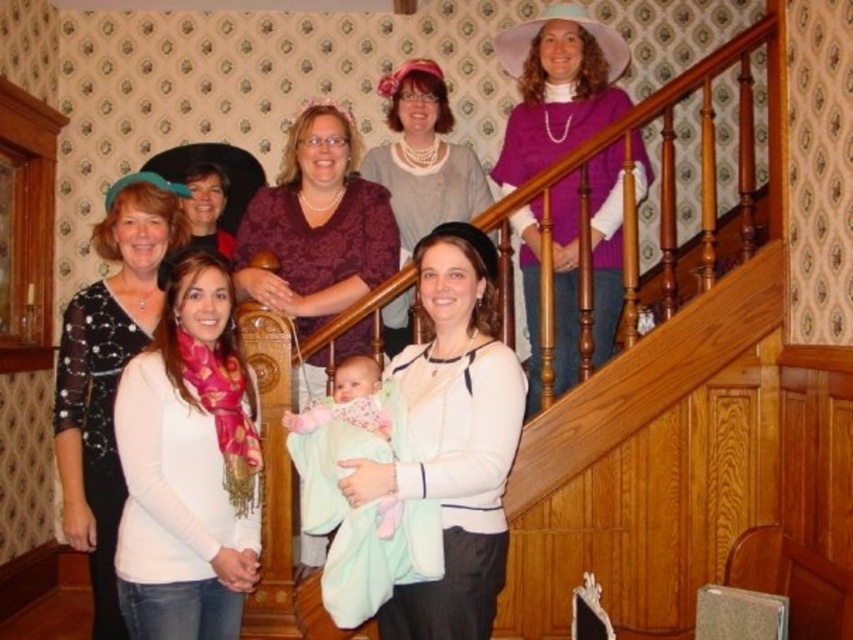
Does point (434, 634) come in front of point (310, 428)?

Yes, it is in front of point (310, 428).

Is white matte sweater at center to the left of soft pastel blanket at center from the viewer's perspective?

Incorrect, white matte sweater at center is not on the left side of soft pastel blanket at center.

Is point (473, 454) behind point (383, 422)?

No, (473, 454) is in front of (383, 422).

Identify the location of white matte sweater at center. (453, 438).

Which is in front, point (323, 408) or point (209, 211)?

Point (323, 408) is in front.

Measure the distance between soft pastel blanket at center and camera.

They are 7.50 feet apart.

At what (x,y) coordinates should I click in order to perform the action: click on soft pastel blanket at center. Please return your answer as a coordinate pair (x, y). This screenshot has height=640, width=853. Looking at the image, I should click on [x=347, y=401].

Between point (190, 595) and point (421, 115), which one is positioned in front?

Point (190, 595) is in front.

Is pink scarf at lower left behind matte gray sweater at center?

That is False.

Who is more distant from viewer, (x=132, y=556) or (x=442, y=173)?

Point (x=442, y=173)

The height and width of the screenshot is (640, 853). Find the location of `pink scarf at lower left`. pink scarf at lower left is located at coordinates (189, 465).